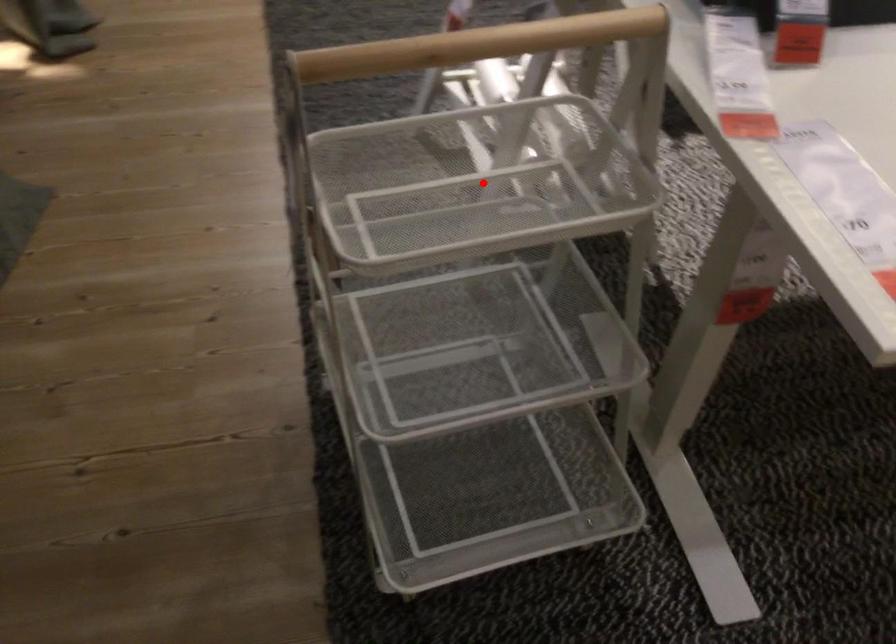
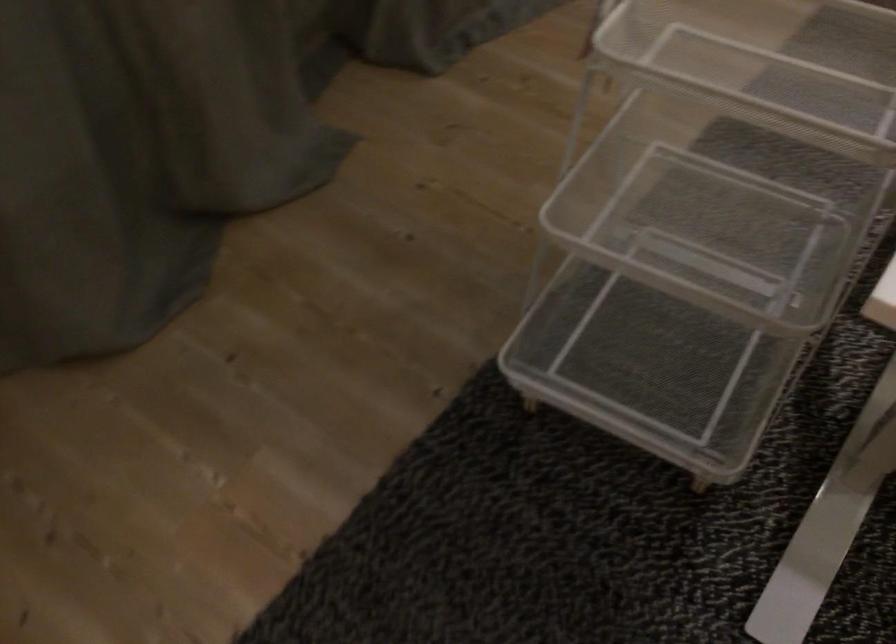
Where in the second image is the point corresponding to the highlighted location from the first image?

(806, 69)